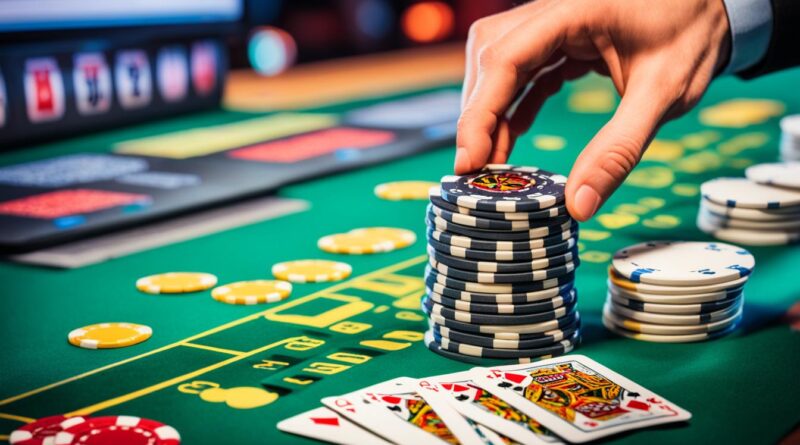
The height and width of the screenshot is (445, 800). Identify the location of playing cards face up. (346, 424), (369, 411), (414, 411), (450, 410), (481, 402), (522, 390).